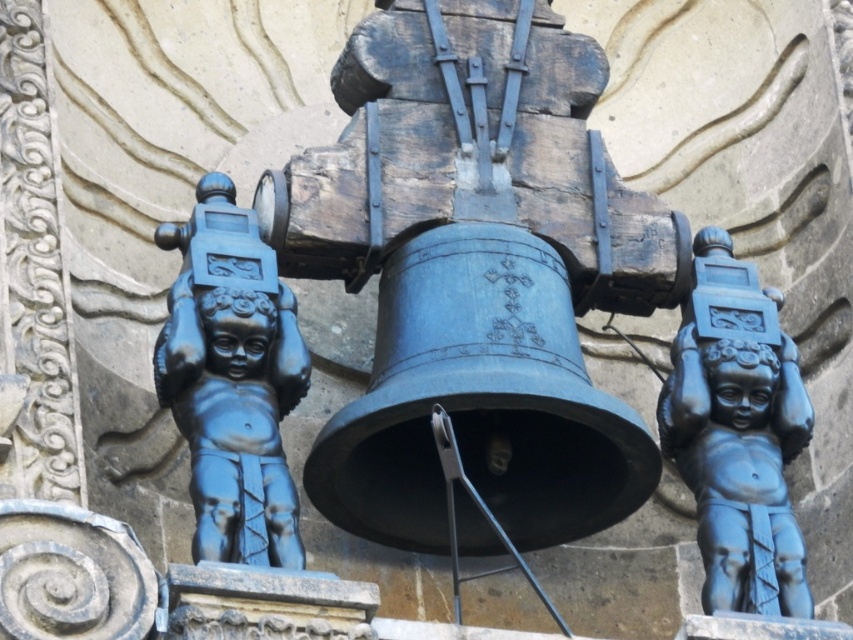
Question: Which point is farther to the camera?

Choices:
 (A) matte black cherub at center
 (B) matte black cherub at left

Answer: (A)

Question: Does matte black cherub at left appear under matte black cherub at center?

Choices:
 (A) no
 (B) yes

Answer: (A)

Question: Observing the image, what is the correct spatial positioning of matte black cherub at left in reference to matte black cherub at center?

Choices:
 (A) below
 (B) above

Answer: (B)

Question: Can you confirm if matte black cherub at left is positioned to the right of matte black cherub at center?

Choices:
 (A) yes
 (B) no

Answer: (B)